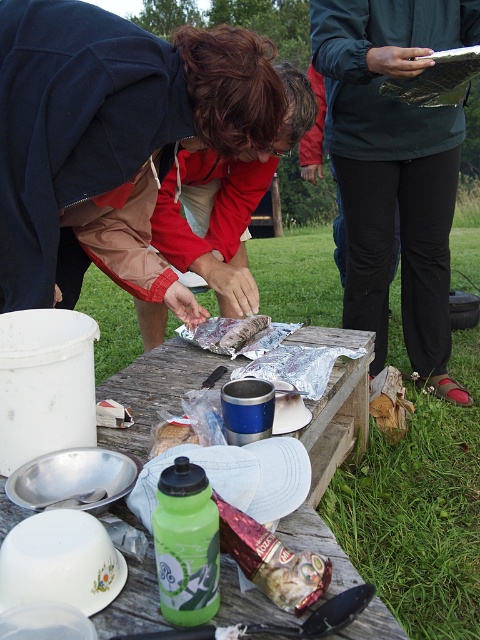
What is the object located at the coordinates point (395, 166) in the image?

The object located at point (395, 166) is the green matte jacket at upper center.

You are planning to place a large rectangular box on the wooden picnic table at center. However, there is a green matte jacket at upper center on the table. Based on their sizes, will the box fit on the table without overlapping the jacket?

The green matte jacket at upper center might be wider than the wooden picnic table at center, so there is a possibility that the box may not fit properly without overlapping the jacket. It is recommended to check the exact dimensions before placing the box.

You are setting up a picnic and need to place a matte red jacket at center and a brown paper bag at center on the table. According to the scene description, where should you position them relative to each other?

The matte red jacket at center should be placed to the left of the brown paper bag at center.